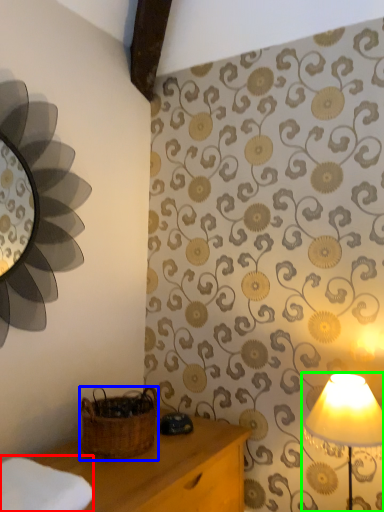
Question: Which object is the closest to the cloth (highlighted by a red box)? Choose among these: basket (highlighted by a blue box) or lamp (highlighted by a green box).

Choices:
 (A) basket
 (B) lamp

Answer: (A)